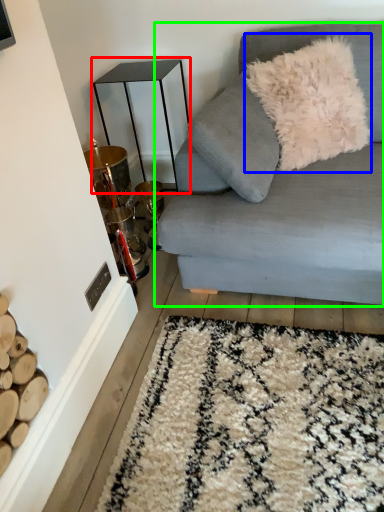
Question: Estimate the real-world distances between objects in this image. Which object is farther from table (highlighted by a red box), throw pillow (highlighted by a blue box) or studio couch (highlighted by a green box)?

Choices:
 (A) throw pillow
 (B) studio couch

Answer: (B)